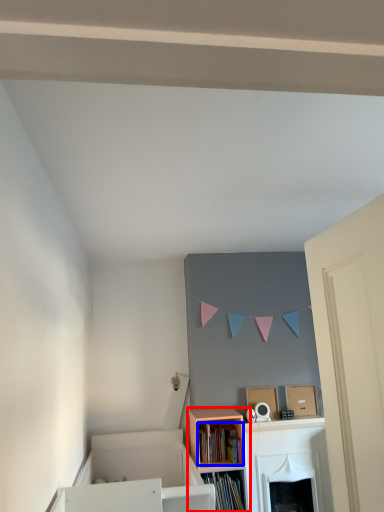
Question: Which of the following is the farthest to the observer, shelf (highlighted by a red box) or book (highlighted by a blue box)?

Choices:
 (A) shelf
 (B) book

Answer: (B)